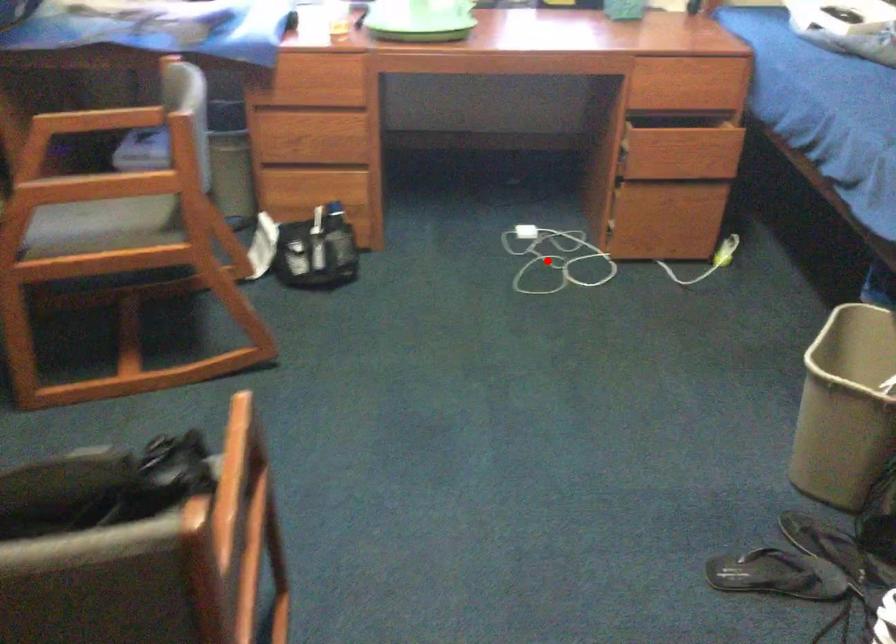
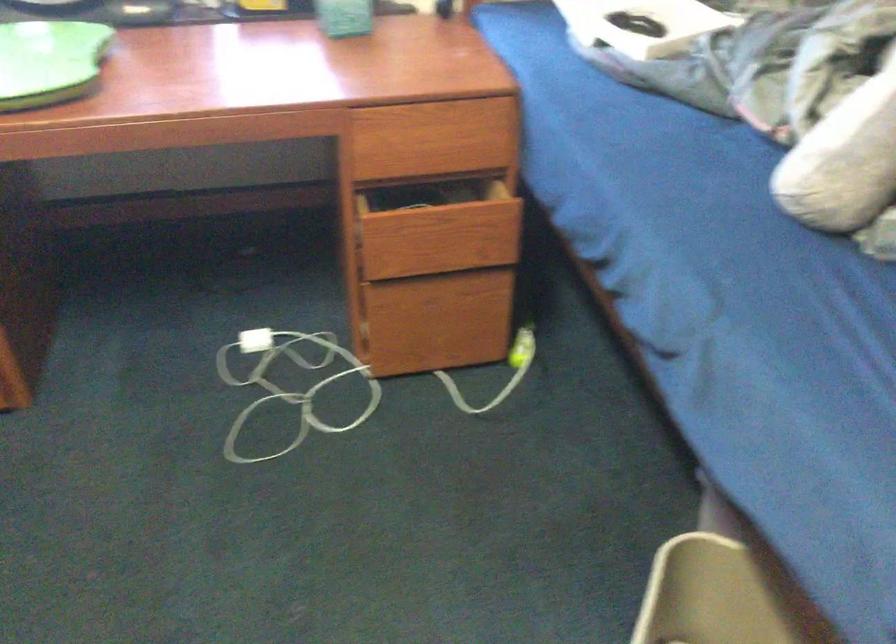
The point at the highlighted location is marked in the first image. Where is the corresponding point in the second image?

(289, 383)